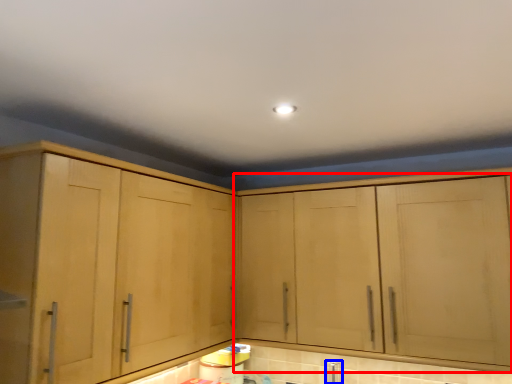
Question: Which object appears farthest to the camera in this image, cabinetry (highlighted by a red box) or faucet (highlighted by a blue box)?

Choices:
 (A) cabinetry
 (B) faucet

Answer: (B)